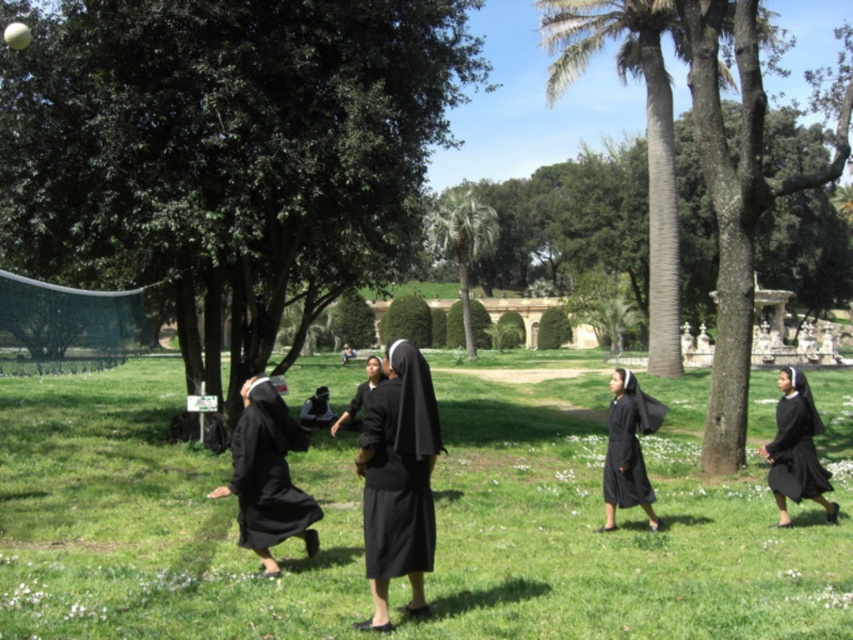
Is smooth brown palm tree at right shorter than matte black habit at center?

In fact, smooth brown palm tree at right may be taller than matte black habit at center.

Can you confirm if smooth brown palm tree at right is wider than matte black habit at center?

Indeed, smooth brown palm tree at right has a greater width compared to matte black habit at center.

Does point (674, 289) lie behind point (393, 365)?

Yes.

Identify the location of smooth brown palm tree at right. point(645,129).

Between point (645, 406) and point (463, 291), which one is positioned in front?

Point (645, 406)

Is point (625, 477) farther from camera compared to point (457, 228)?

No, (625, 477) is in front of (457, 228).

Is point (648, 428) behind point (462, 214)?

No, (648, 428) is in front of (462, 214).

At what (x,y) coordinates should I click in order to perform the action: click on black matte nun at center. Please return your answer as a coordinate pair (x, y). Looking at the image, I should click on (628, 449).

Does black matte nun at center appear on the left side of black matte dress at right?

Yes, black matte nun at center is to the left of black matte dress at right.

Is black matte nun at center below black matte dress at right?

Yes, black matte nun at center is below black matte dress at right.

Find the location of a particular element. This screenshot has height=640, width=853. black matte nun at center is located at coordinates (628, 449).